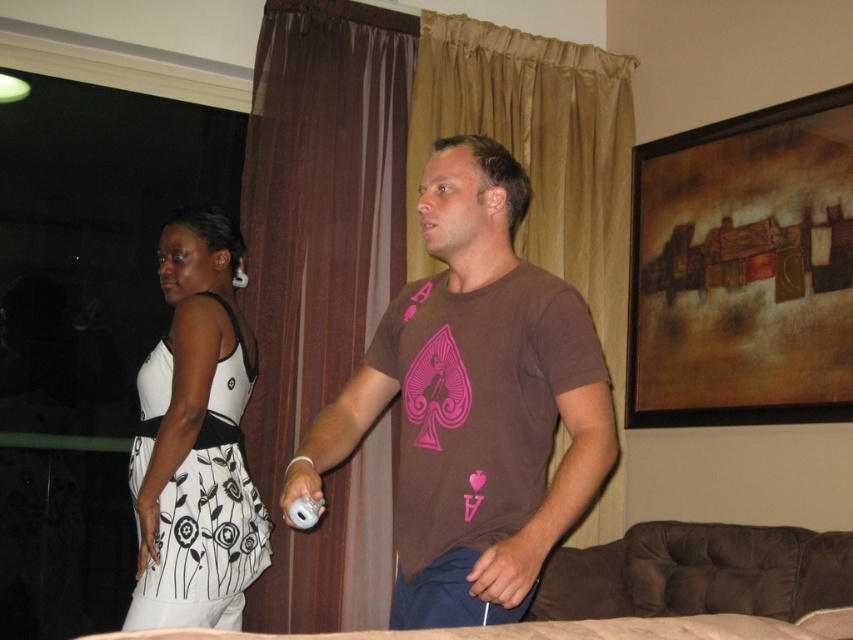
You are standing in the living room and want to see the TV screen clearly. You notice the brown sheer curtain at center and the white floral dress at left. Which object is blocking your view of the TV screen?

The brown sheer curtain at center is located above the white floral dress at left, so it might be blocking the view of the TV screen if positioned in front of it.

You are planning to hang a new curtain that is the same size as the white floral dress at left on the window where the brown sheer curtain at center is currently hanging. Will the new curtain fit the window?

The brown sheer curtain at center is wider than the white floral dress at left. Since the new curtain is the same size as the white floral dress at left, it will be narrower than the current curtain. Therefore, the new curtain will fit the window as it is smaller in width.